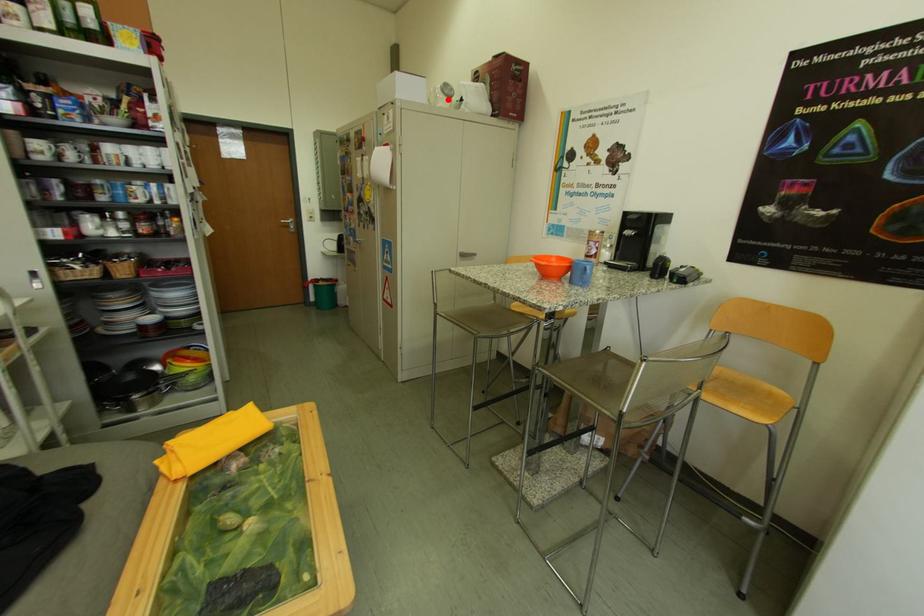
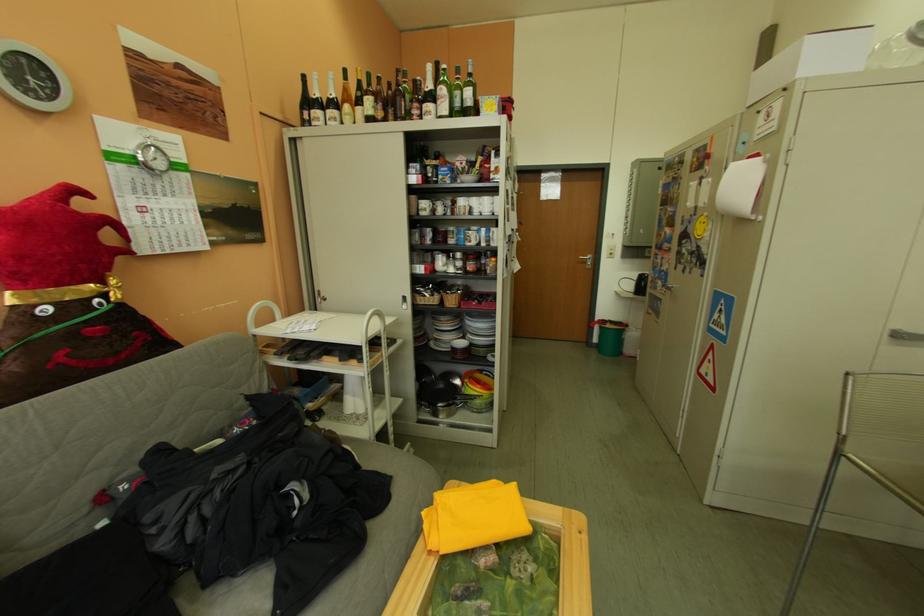
Where in the second image is the point corresponding to the highlighted location from the first image?

(904, 55)